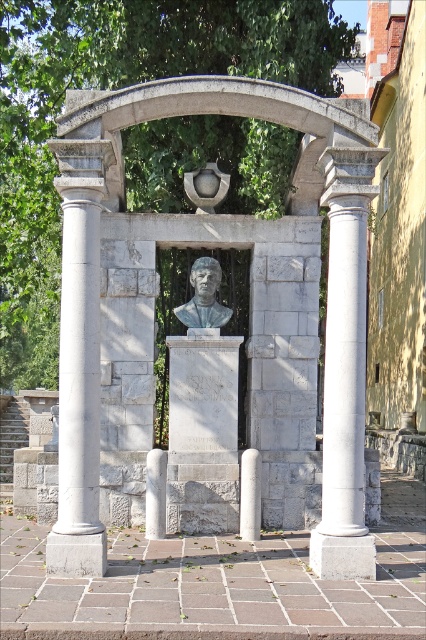
You are a visitor at the memorial and want to take a photo of the matte gray bust at center without the white marble column at center blocking the view. Is this possible from your current position?

The white marble column at center is in front of the matte gray bust at center, so taking a photo of the matte gray bust at center without the column blocking the view from the current position is not possible.